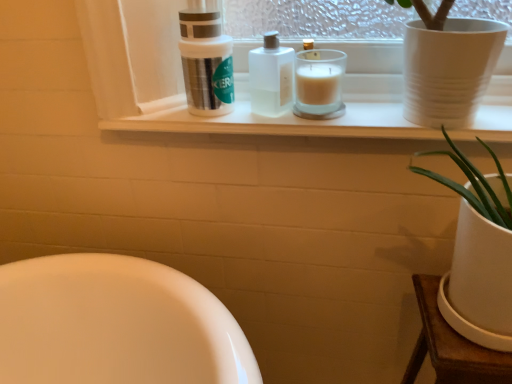
Image resolution: width=512 pixels, height=384 pixels. I want to click on vacant area located to the right-hand side of translucent glass candle at center, so click(376, 116).